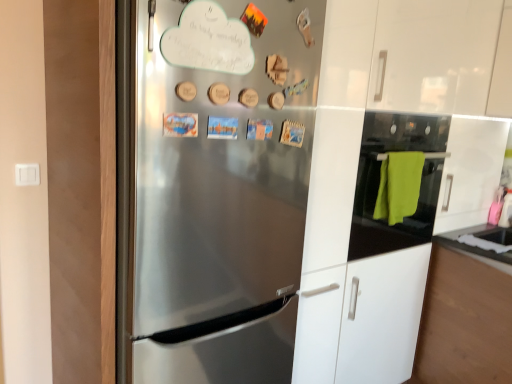
Question: From the image's perspective, is black glass oven at right located above stainless steel refrigerator at center?

Choices:
 (A) no
 (B) yes

Answer: (B)

Question: Does black glass oven at right turn towards stainless steel refrigerator at center?

Choices:
 (A) no
 (B) yes

Answer: (A)

Question: Is black glass oven at right wider than stainless steel refrigerator at center?

Choices:
 (A) no
 (B) yes

Answer: (A)

Question: Does black glass oven at right have a lesser width compared to stainless steel refrigerator at center?

Choices:
 (A) yes
 (B) no

Answer: (A)

Question: Considering the relative sizes of black glass oven at right and stainless steel refrigerator at center in the image provided, is black glass oven at right smaller than stainless steel refrigerator at center?

Choices:
 (A) yes
 (B) no

Answer: (A)

Question: From a real-world perspective, is black glass oven at right beneath stainless steel refrigerator at center?

Choices:
 (A) no
 (B) yes

Answer: (A)

Question: Does stainless steel refrigerator at center appear on the left side of black glass oven at right?

Choices:
 (A) no
 (B) yes

Answer: (B)

Question: Is stainless steel refrigerator at center to the right of black glass oven at right from the viewer's perspective?

Choices:
 (A) yes
 (B) no

Answer: (B)

Question: Does stainless steel refrigerator at center touch black glass oven at right?

Choices:
 (A) yes
 (B) no

Answer: (B)

Question: Is stainless steel refrigerator at center thinner than black glass oven at right?

Choices:
 (A) no
 (B) yes

Answer: (A)

Question: Is stainless steel refrigerator at center positioned beyond the bounds of black glass oven at right?

Choices:
 (A) yes
 (B) no

Answer: (A)

Question: Is stainless steel refrigerator at center looking in the opposite direction of black glass oven at right?

Choices:
 (A) yes
 (B) no

Answer: (B)

Question: From the image's perspective, relative to black glass oven at right, is stainless steel refrigerator at center above or below?

Choices:
 (A) above
 (B) below

Answer: (B)